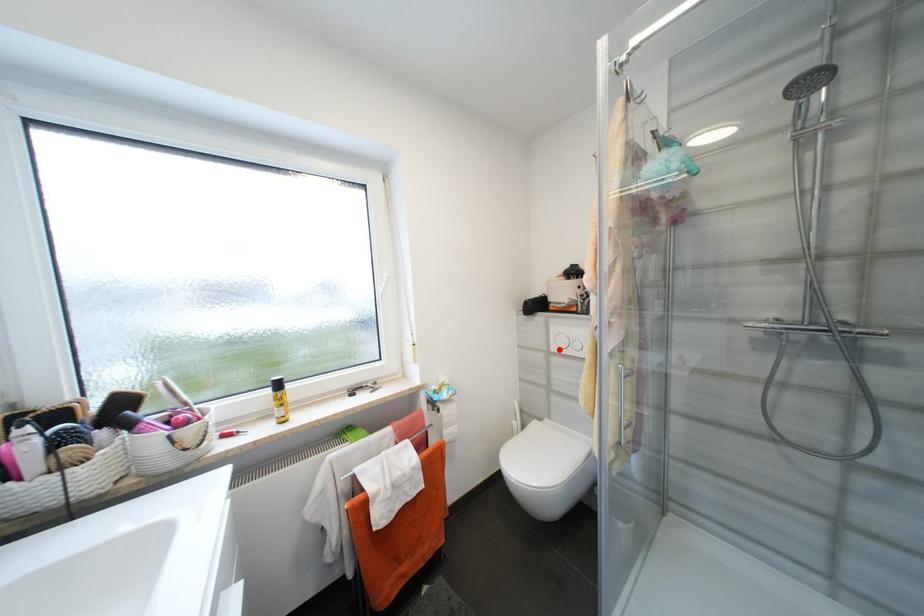
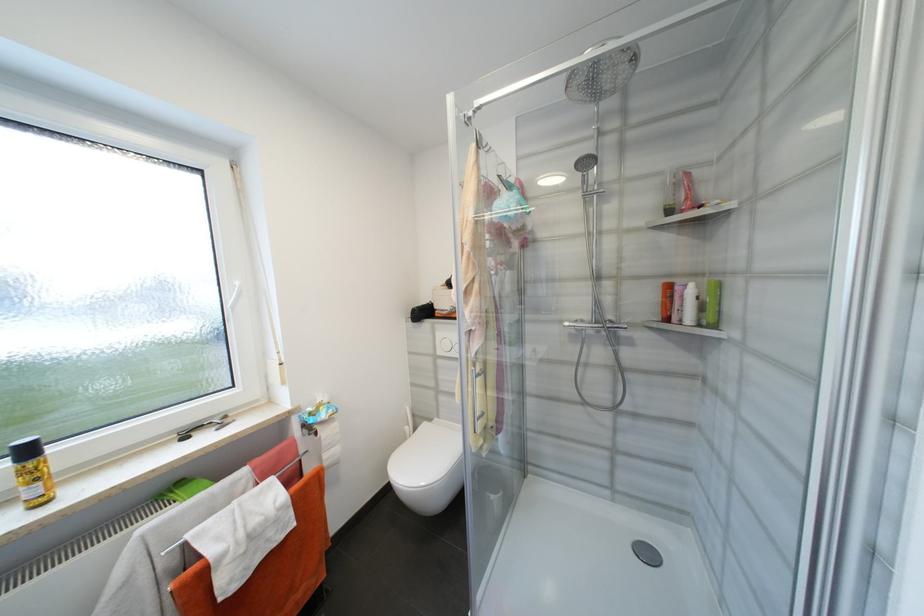
Locate, in the second image, the point that corresponds to the highlighted location in the first image.

(445, 353)